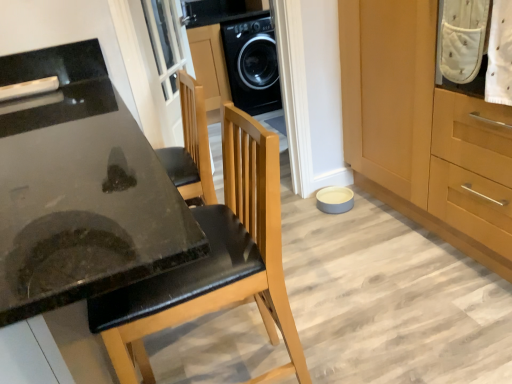
Question: Considering the relative sizes of black glossy countertop at lower left and white dotted fabric at upper right in the image provided, is black glossy countertop at lower left wider than white dotted fabric at upper right?

Choices:
 (A) no
 (B) yes

Answer: (B)

Question: Is white dotted fabric at upper right located within black glossy countertop at lower left?

Choices:
 (A) no
 (B) yes

Answer: (A)

Question: Does black glossy countertop at lower left have a lesser height compared to white dotted fabric at upper right?

Choices:
 (A) no
 (B) yes

Answer: (A)

Question: From a real-world perspective, is black glossy countertop at lower left located higher than white dotted fabric at upper right?

Choices:
 (A) no
 (B) yes

Answer: (A)

Question: Can you confirm if black glossy countertop at lower left is positioned to the left of white dotted fabric at upper right?

Choices:
 (A) yes
 (B) no

Answer: (A)

Question: From the image's perspective, is black glossy countertop at lower left under white dotted fabric at upper right?

Choices:
 (A) no
 (B) yes

Answer: (B)

Question: Can you confirm if white dotted fabric at upper right is positioned to the left of white glass screen door at upper center?

Choices:
 (A) no
 (B) yes

Answer: (A)

Question: Does white dotted fabric at upper right have a greater height compared to white glass screen door at upper center?

Choices:
 (A) no
 (B) yes

Answer: (A)

Question: Considering the relative sizes of white dotted fabric at upper right and white glass screen door at upper center in the image provided, is white dotted fabric at upper right shorter than white glass screen door at upper center?

Choices:
 (A) no
 (B) yes

Answer: (B)

Question: Can you confirm if white dotted fabric at upper right is smaller than white glass screen door at upper center?

Choices:
 (A) no
 (B) yes

Answer: (B)

Question: Is white dotted fabric at upper right bigger than white glass screen door at upper center?

Choices:
 (A) no
 (B) yes

Answer: (A)

Question: Is white dotted fabric at upper right behind white glass screen door at upper center?

Choices:
 (A) no
 (B) yes

Answer: (A)

Question: Can we say wooden cabinet at lower right lies outside black leather chair at center?

Choices:
 (A) no
 (B) yes

Answer: (B)